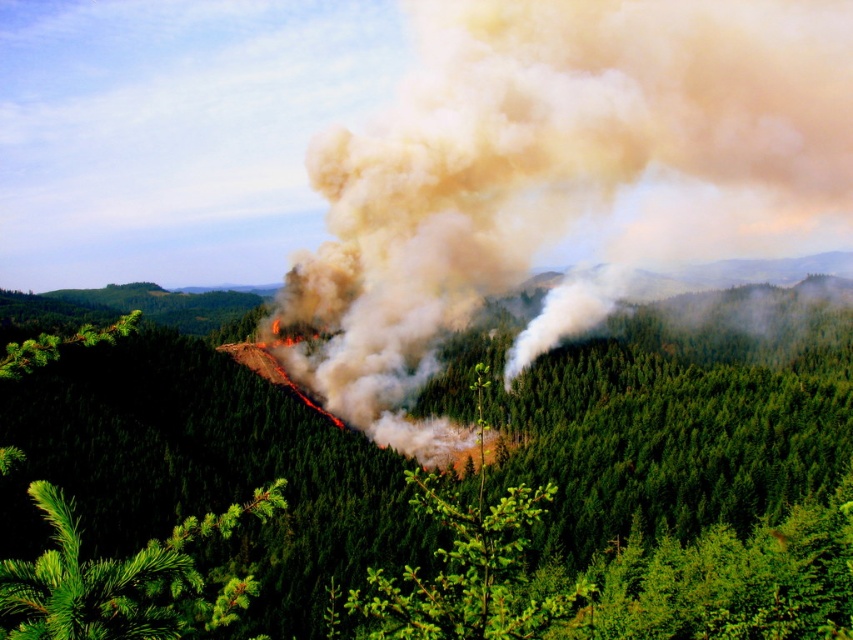
Question: Which of the following is the closest to the observer?

Choices:
 (A) (45, 497)
 (B) (473, 582)

Answer: (A)

Question: Is smoke cloud at center below green leafy tree at center?

Choices:
 (A) yes
 (B) no

Answer: (B)

Question: Which of these objects is positioned closest to the green needle-like at center?

Choices:
 (A) smoke cloud at center
 (B) green textured tree at center
 (C) green leafy tree at center

Answer: (C)

Question: Can you confirm if green needle-like at center is positioned to the right of green leafy tree at center?

Choices:
 (A) yes
 (B) no

Answer: (B)

Question: Which of the following is the farthest from the observer?

Choices:
 (A) (483, 365)
 (B) (170, 596)
 (C) (532, 65)
 (D) (167, 595)

Answer: (C)

Question: Is green textured tree at center further to the viewer compared to green needle-like at center?

Choices:
 (A) yes
 (B) no

Answer: (A)